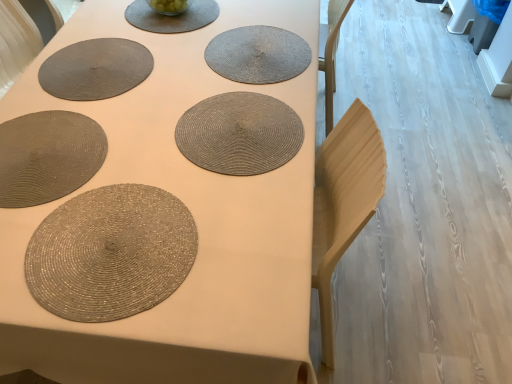
Question: Is matte gray placemat at upper center smaller than rattan placemat at center, the 1th coaster from the top?

Choices:
 (A) no
 (B) yes

Answer: (B)

Question: Can you confirm if matte gray placemat at upper center is bigger than rattan placemat at center, which appears as the first coaster when viewed from the back?

Choices:
 (A) yes
 (B) no

Answer: (B)

Question: Can you confirm if matte gray placemat at upper center is taller than rattan placemat at center, which appears as the first coaster when viewed from the back?

Choices:
 (A) yes
 (B) no

Answer: (B)

Question: Could rattan placemat at center, which is the 2th coaster in front-to-back order, be considered to be inside matte gray placemat at upper center?

Choices:
 (A) yes
 (B) no

Answer: (B)

Question: Are matte gray placemat at upper center and rattan placemat at center, arranged as the 2th coaster when ordered from the bottom, located far from each other?

Choices:
 (A) no
 (B) yes

Answer: (A)

Question: Is matte gray placemat at upper center further to the viewer compared to rattan placemat at center, arranged as the 2th coaster when ordered from the bottom?

Choices:
 (A) yes
 (B) no

Answer: (A)

Question: Can you confirm if rattan placemat at center, which is the 2th coaster in front-to-back order, is positioned to the right of matte gray placemat at upper center?

Choices:
 (A) no
 (B) yes

Answer: (B)

Question: Is rattan placemat at center, arranged as the 2th coaster when ordered from the bottom, outside of matte gray placemat at upper center?

Choices:
 (A) no
 (B) yes

Answer: (B)

Question: Is rattan placemat at center, which is the 2th coaster in front-to-back order, wider than matte gray placemat at upper center?

Choices:
 (A) yes
 (B) no

Answer: (B)

Question: Is rattan placemat at center, which appears as the first coaster when viewed from the back, positioned far away from matte gray placemat at upper center?

Choices:
 (A) no
 (B) yes

Answer: (A)

Question: Is rattan placemat at center, which is the 2th coaster in front-to-back order, oriented away from matte gray placemat at upper center?

Choices:
 (A) yes
 (B) no

Answer: (A)

Question: Does rattan placemat at center, the 1th coaster from the top, lie in front of matte gray placemat at upper center?

Choices:
 (A) no
 (B) yes

Answer: (B)

Question: Is the depth of rattan placemat at center, which appears as the 1th coaster when viewed from the front, less than that of matte gray placemat at upper center?

Choices:
 (A) yes
 (B) no

Answer: (A)